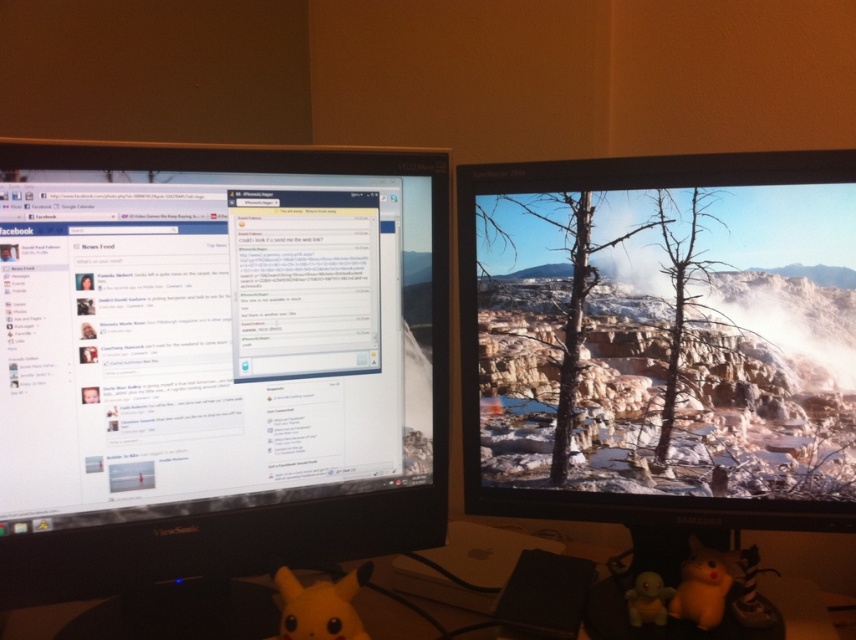
Question: Estimate the real-world distances between objects in this image. Which object is farther from the yellow plush toy at lower right?

Choices:
 (A) matte black monitor at right
 (B) matte yellow rubber duck at lower right
 (C) black plastic table at lower center
 (D) black glossy monitor at left

Answer: (D)

Question: Does black glossy monitor at left appear on the right side of matte yellow rubber duck at lower right?

Choices:
 (A) no
 (B) yes

Answer: (A)

Question: Is black glossy monitor at left to the left of matte yellow plush at lower center from the viewer's perspective?

Choices:
 (A) yes
 (B) no

Answer: (A)

Question: Considering the real-world distances, which object is closest to the black plastic table at lower center?

Choices:
 (A) black glossy monitor at left
 (B) matte yellow plush at lower center
 (C) matte yellow rubber duck at lower right
 (D) matte black monitor at right

Answer: (B)

Question: Based on their relative distances, which object is nearer to the black glossy monitor at left?

Choices:
 (A) matte yellow rubber duck at lower right
 (B) matte yellow plush at lower center

Answer: (B)

Question: Where is matte black monitor at right located in relation to matte yellow plush at lower center in the image?

Choices:
 (A) left
 (B) right

Answer: (B)